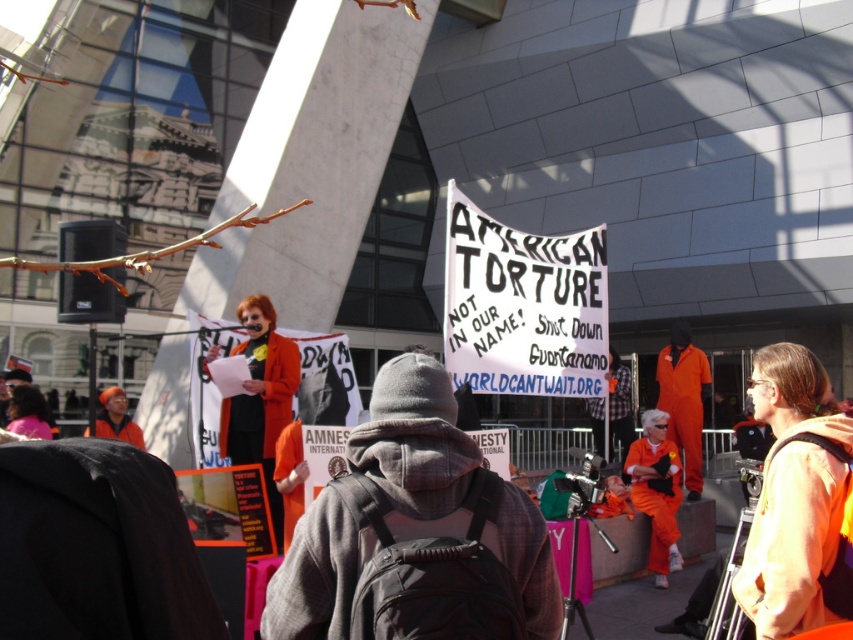
Question: Does orange jumpsuit at center appear on the right side of orange fabric at lower right?

Choices:
 (A) no
 (B) yes

Answer: (A)

Question: Which object appears farthest from the camera in this image?

Choices:
 (A) orange fabric at lower right
 (B) orange jumpsuit at center

Answer: (A)

Question: Which point is closer to the camera?

Choices:
 (A) orange fabric at lower right
 (B) orange jumpsuit at center

Answer: (B)

Question: Can you confirm if orange jumpsuit at center is positioned above orange fabric at lower right?

Choices:
 (A) yes
 (B) no

Answer: (A)

Question: Does orange jumpsuit at center have a greater width compared to orange fabric at lower right?

Choices:
 (A) no
 (B) yes

Answer: (B)